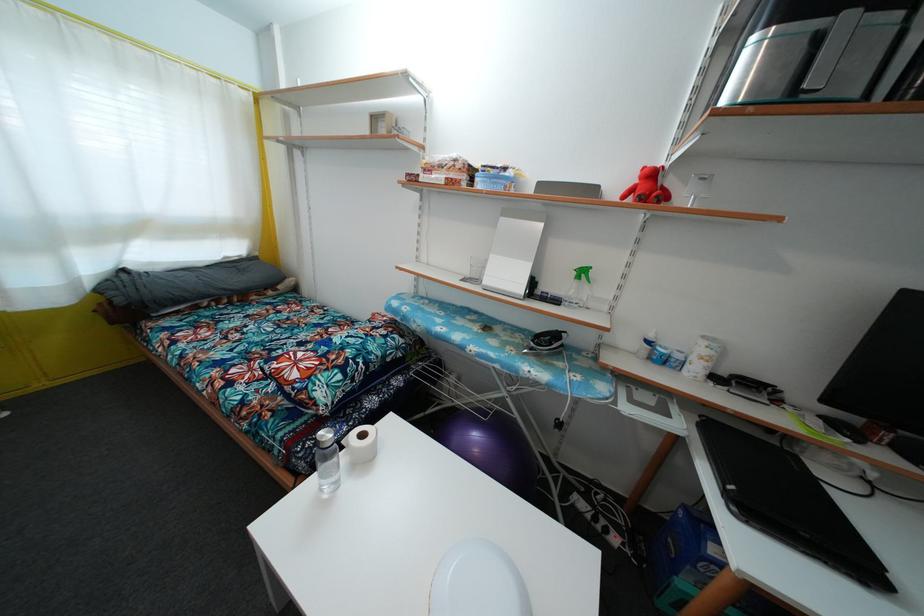
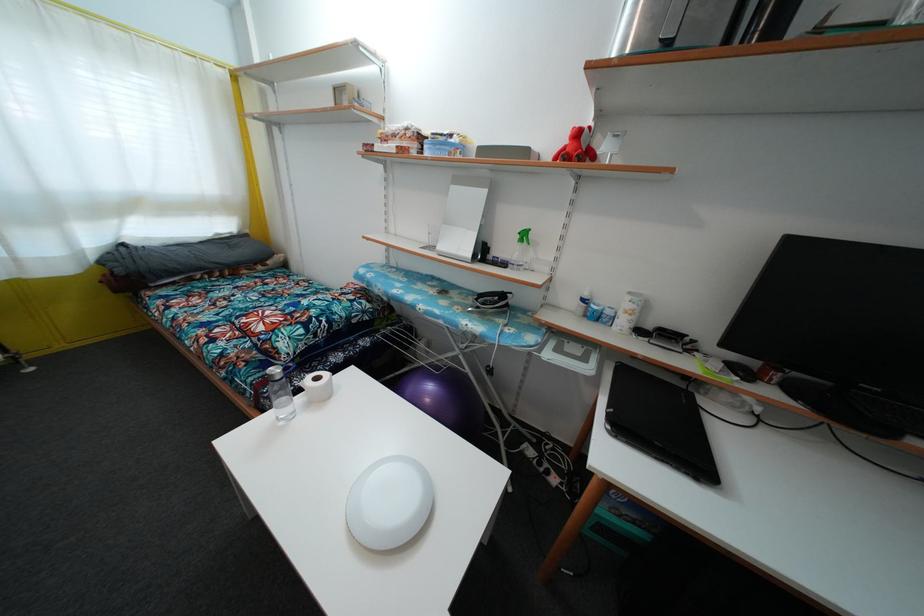
Where in the second image is the point corresponding to pixel 824 424 from the first image?

(728, 369)